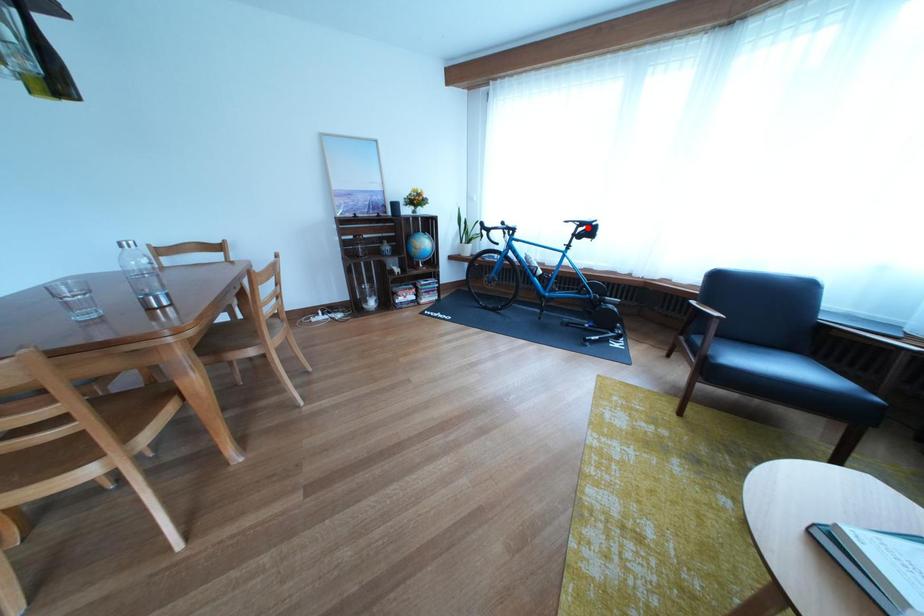
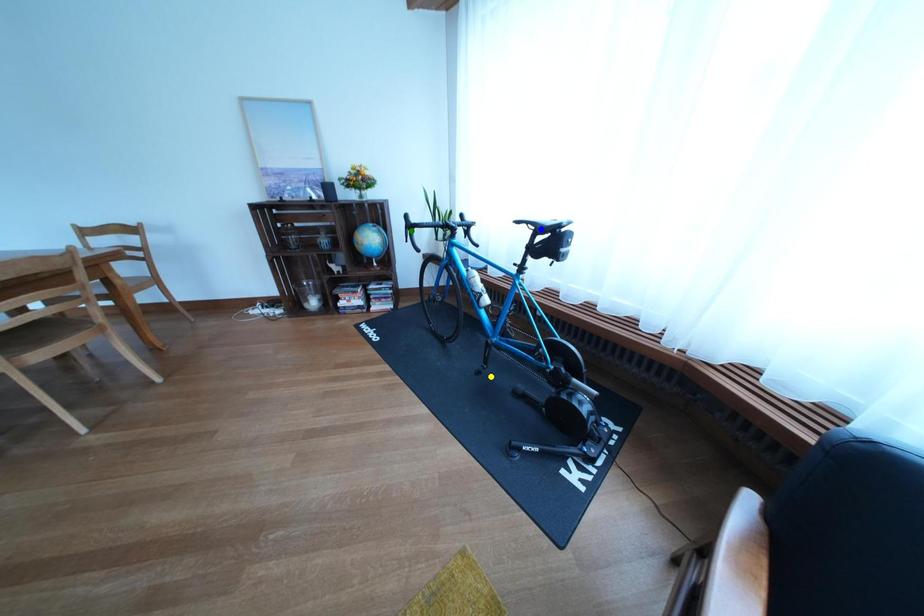
Question: I am providing you with two images of the same scene from different viewpoints. A red point is marked on the first image. You are given multiple points on the second image. In image 2, which mark is for the same physical point as the one in image 1?

Choices:
 (A) blue point
 (B) green point
 (C) yellow point

Answer: (A)